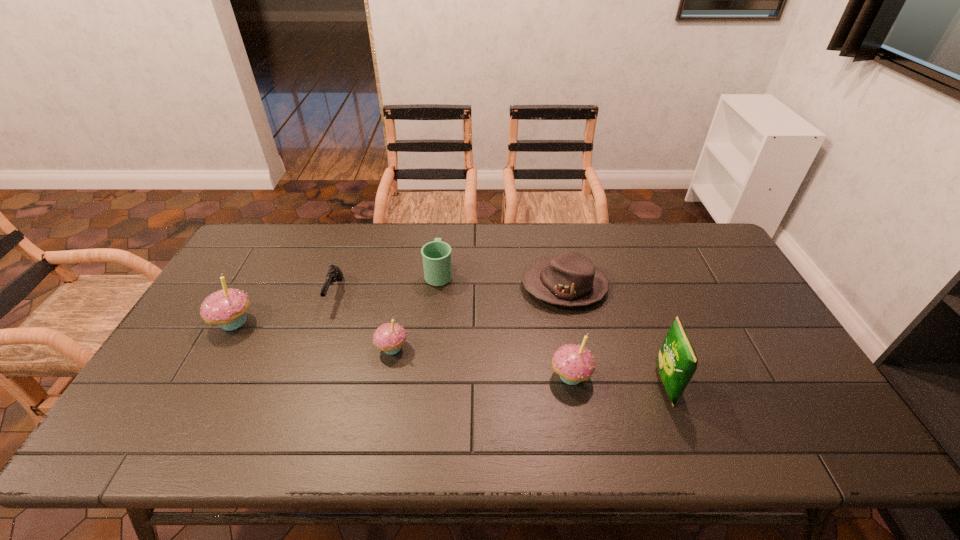
Locate an element on the screen. blank space located on the front-facing side of the rightmost object is located at coordinates (564, 384).

This screenshot has width=960, height=540. I want to click on free space located on the front-facing side of the rightmost object, so click(x=516, y=384).

What are the coordinates of `free spot located 0.090m on the front-facing side of the rightmost object` in the screenshot? It's located at (620, 384).

Identify the location of mug that is at the far edge. This screenshot has height=540, width=960. (436, 255).

I want to click on hat that is at the far edge, so click(570, 279).

Identify the location of cupcake located in the near edge section of the desktop. (573, 363).

Where is `crisp (potato chip) that is at the near edge`? The image size is (960, 540). crisp (potato chip) that is at the near edge is located at coordinates (677, 361).

At what (x,y) coordinates should I click in order to perform the action: click on object that is at the left edge. Please return your answer as a coordinate pair (x, y). Image resolution: width=960 pixels, height=540 pixels. Looking at the image, I should click on (227, 308).

Where is `free space at the far edge of the desktop`? free space at the far edge of the desktop is located at coordinates (641, 234).

At what (x,y) coordinates should I click in order to perform the action: click on free location at the near edge. Please return your answer as a coordinate pair (x, y). The height and width of the screenshot is (540, 960). Looking at the image, I should click on (620, 411).